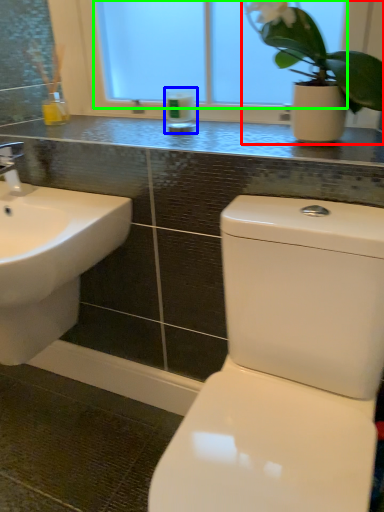
Question: Which is farther away from houseplant (highlighted by a red box)? toiletry (highlighted by a blue box) or window screen (highlighted by a green box)?

Choices:
 (A) toiletry
 (B) window screen

Answer: (A)